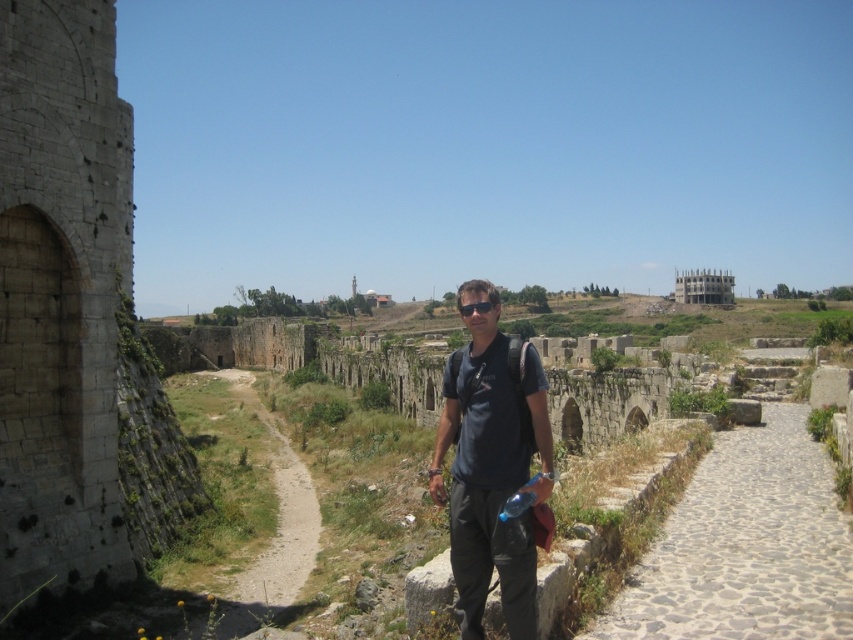
You are a tourist exploring the ancient site and want to take a photo of the stone archway at left and the brown dirt path at center. If you stand on the path, which side of the path should you position yourself to capture both objects in the frame?

The stone archway at left is positioned on the right side of brown dirt path at center, so you should position yourself on the left side of the path to capture both objects in the frame.